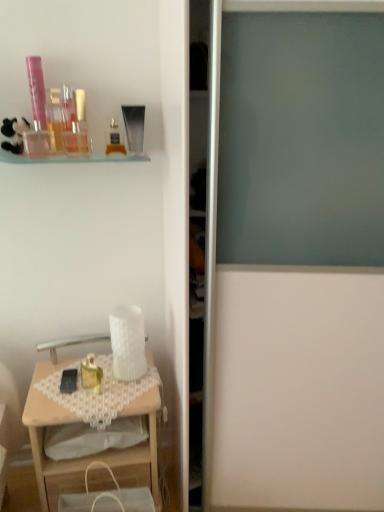
Locate an element on the screen. vacant region to the left of black matte mobile phone at lower left is located at coordinates (47, 377).